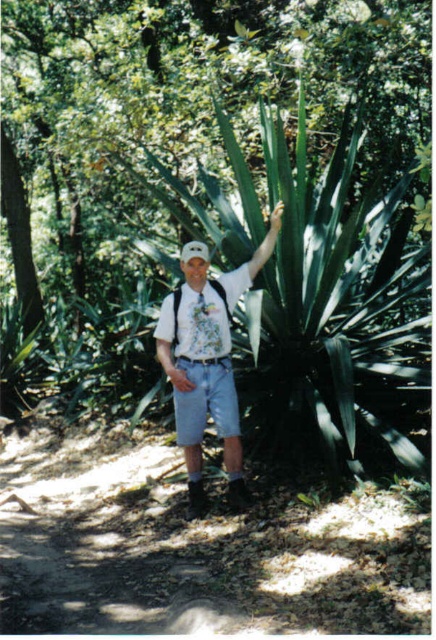
Question: From the image, what is the correct spatial relationship of green leafy plant at center in relation to white cotton shirt at center?

Choices:
 (A) below
 (B) above

Answer: (B)

Question: Does green leafy plant at center appear under white printed t-shirt at center?

Choices:
 (A) yes
 (B) no

Answer: (B)

Question: Which point is farther from the camera taking this photo?

Choices:
 (A) (211, 152)
 (B) (181, 336)
 (C) (181, 344)
 (D) (222, 380)

Answer: (A)

Question: Does white cotton shirt at center have a greater width compared to denim shorts at center?

Choices:
 (A) yes
 (B) no

Answer: (A)

Question: Considering the real-world distances, which object is closest to the white cotton shirt at center?

Choices:
 (A) green leafy plant at center
 (B) denim shorts at center

Answer: (B)

Question: Which point is closer to the camera?

Choices:
 (A) white cotton shirt at center
 (B) green leafy plant at center
 (C) white printed t-shirt at center
 (D) denim shorts at center

Answer: (B)